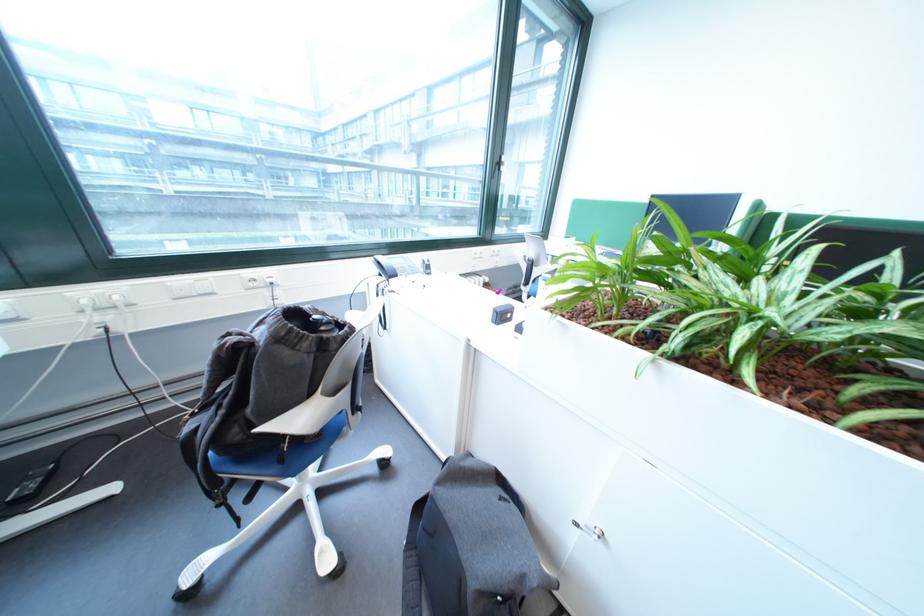
Describe the element at coordinates (395, 265) in the screenshot. This screenshot has width=924, height=616. I see `the telephone handset` at that location.